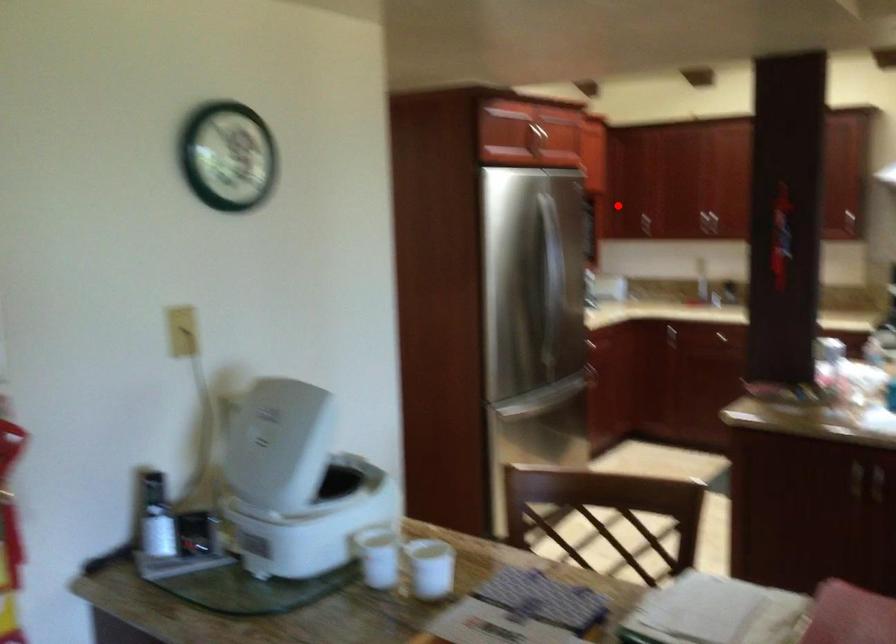
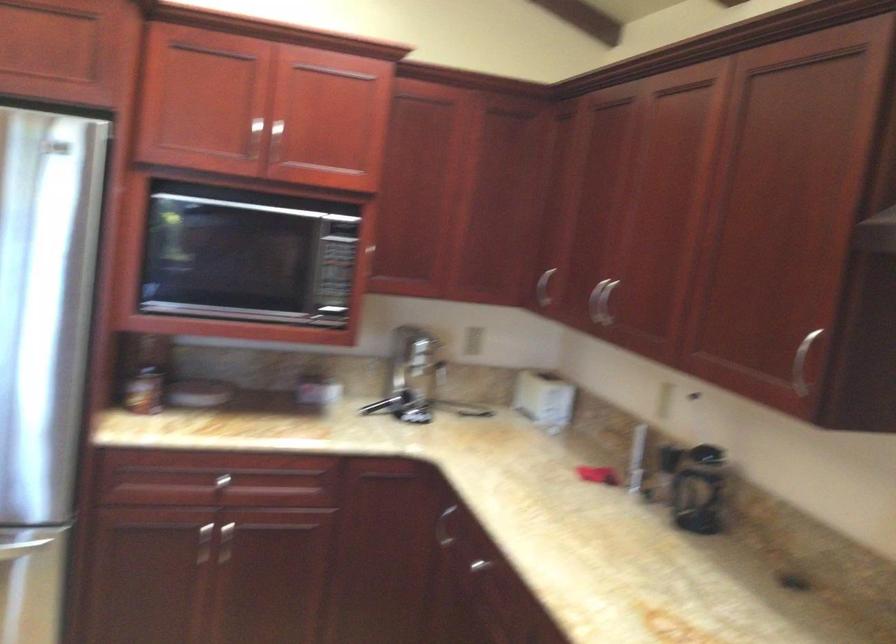
Locate, in the second image, the point that corresponds to the highlighted location in the first image.

(544, 287)